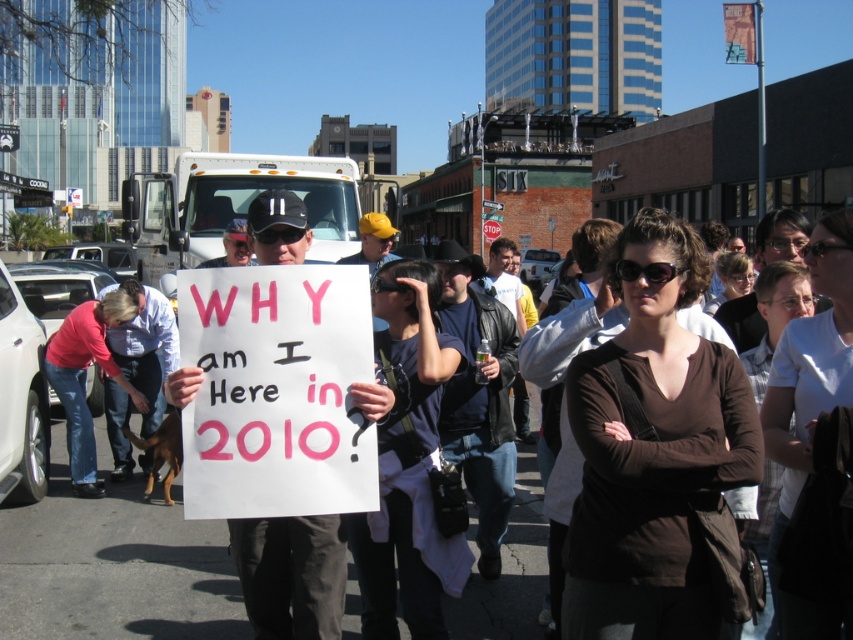
You are standing in the middle of the street and see two points marked in the image. Which point, point (813, 288) or point (764, 605), is closer to you?

Point (813, 288) is closer to the viewer than point (764, 605).

Consider the image. You are a photographer trying to capture a closeup of the brown fabric shirt at center and the white cotton shirt at center. Which shirt should you zoom in on first to ensure it fits entirely within your camera frame?

The brown fabric shirt at center has a lesser width compared to the white cotton shirt at center, so you should zoom in on the white cotton shirt at center first to ensure it fits entirely within your camera frame.